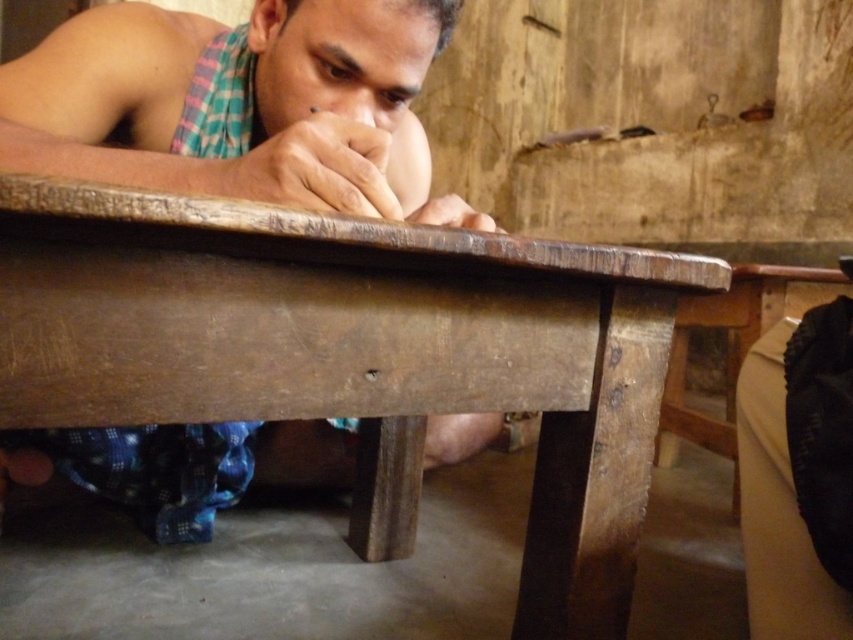
You are a visitor observing the scene. You notice the rough wooden table at center and the matte brown finger at center. Which object occupies a larger area in the image?

The rough wooden table at center is bigger than the matte brown finger at center, so the rough wooden table at center occupies a larger area in the image.

You are standing at the origin point of the coordinate system. Where is the wooden table at center located?

The wooden table at center is located at point (235, 100).